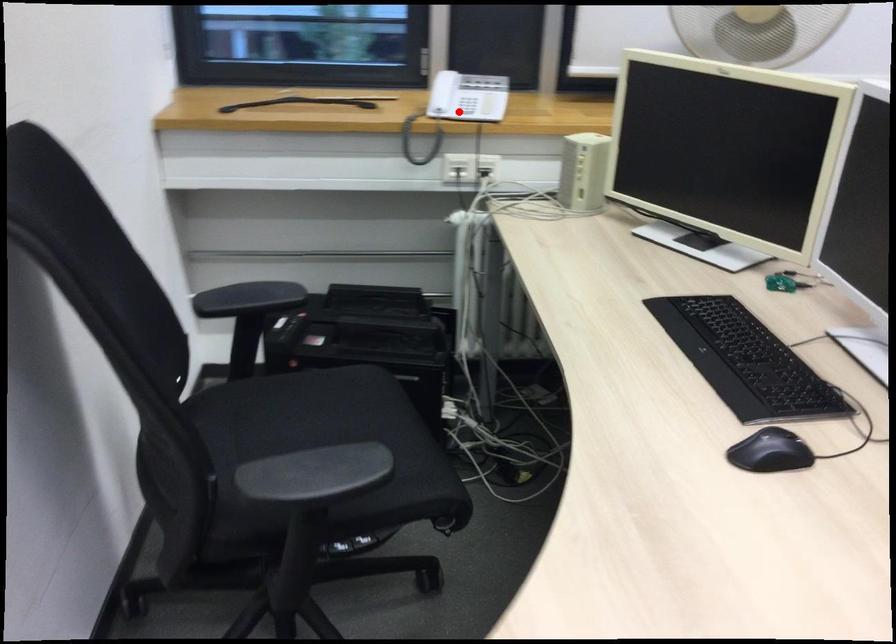
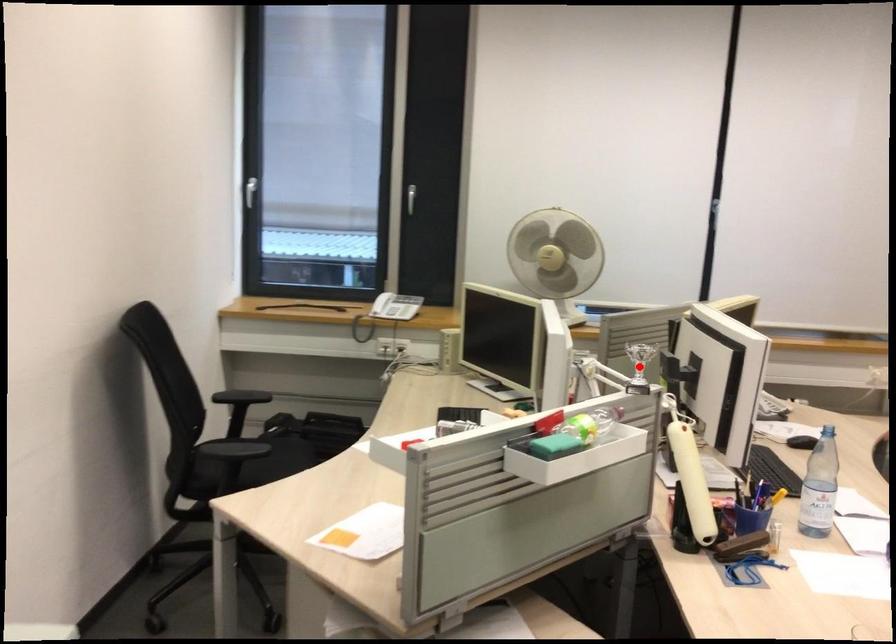
I am providing you with two images of the same scene from different viewpoints. A red point is marked on the first image and another point is marked on the second image. Does the point marked in image1 correspond to the same location as the one in image2?

No